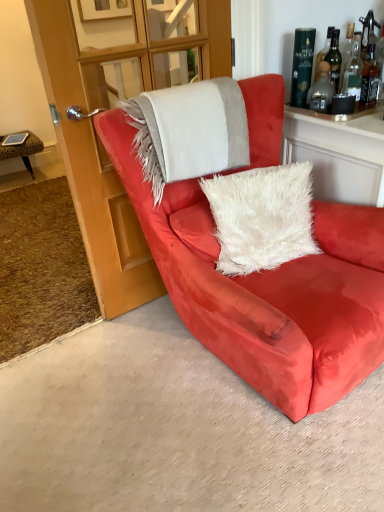
This screenshot has width=384, height=512. I want to click on free space between transparent glass door at upper center and satin red armchair at center, so click(x=150, y=370).